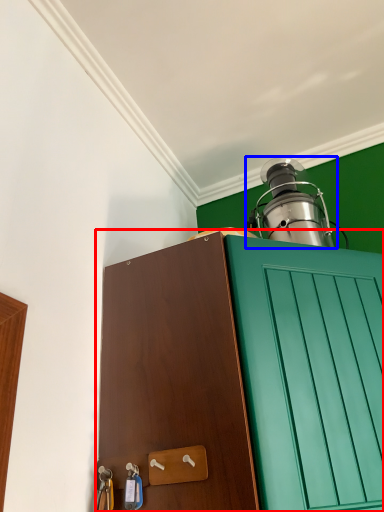
Question: Which object appears closest to the camera in this image, cabinetry (highlighted by a red box) or oil lamp (highlighted by a blue box)?

Choices:
 (A) cabinetry
 (B) oil lamp

Answer: (A)